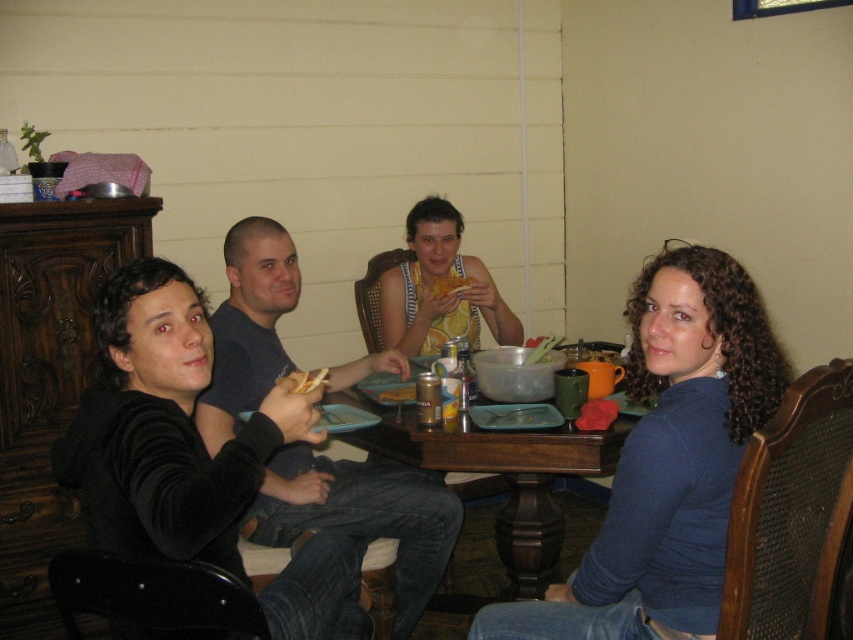
You are a guest at the gathering and want to reach for the yellow matte bread at center and the shiny metallic can at center. How far apart are these two items on the table?

The yellow matte bread at center is 21.62 inches away from the shiny metallic can at center.

You are planning to place a small decorative item on the table between the yellow matte bread at center and the shiny metallic can at center. Which object should you move to make space?

Answer: Since the yellow matte bread at center is wider than the shiny metallic can at center, you should move the yellow matte bread at center to create enough space for the decorative item.

Based on the photo, you are a person who just entered the room and wants to grab the shiny metallic can at center. Can you reach it without moving the wooden table at center?

The wooden table at center is much taller than the shiny metallic can at center, so the can is likely placed on the table. Since the table is in the way, you would need to move around it to reach the can unless you can reach over the table. However, the height difference might make it difficult to reach over, so it depends on your height and arm length.